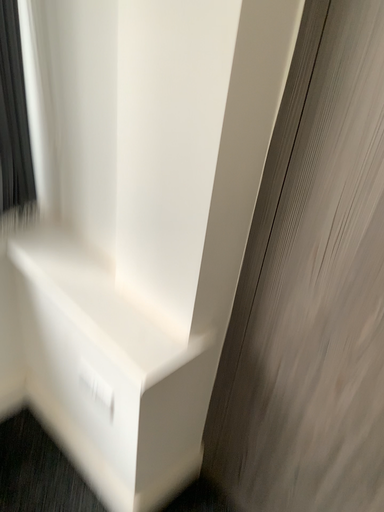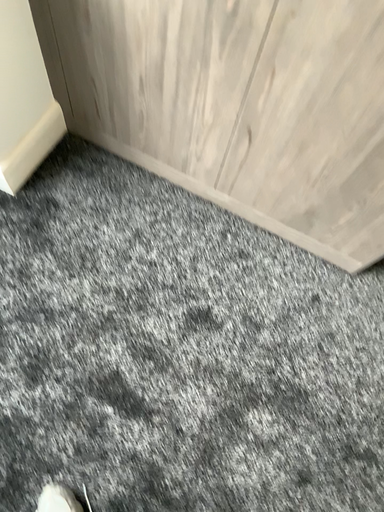
Question: Which way did the camera rotate in the video?

Choices:
 (A) rotated right
 (B) rotated left

Answer: (A)